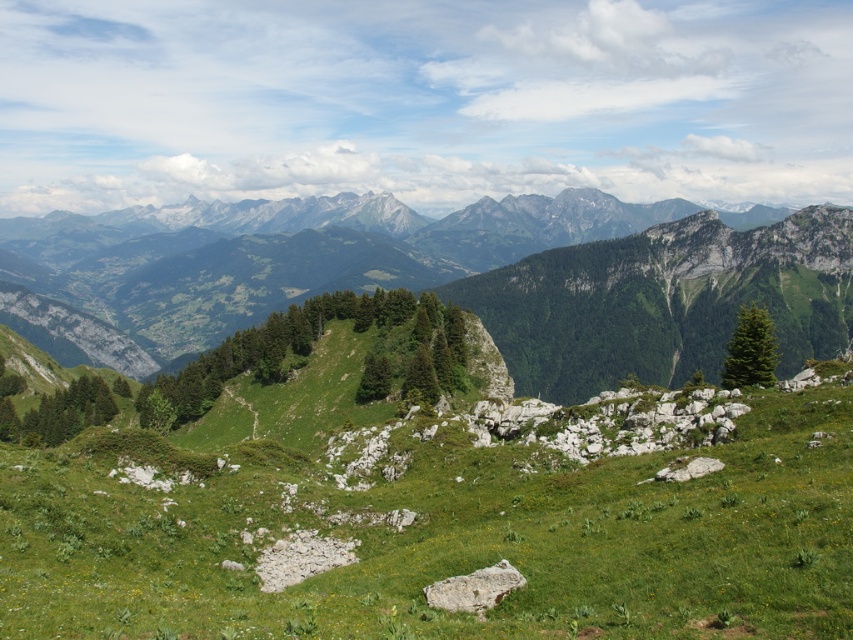
Can you confirm if green grassy hillside at center is shorter than green grassy mountain range at upper center?

Yes.

Is green grassy hillside at center smaller than green grassy mountain range at upper center?

Yes.

The image size is (853, 640). What do you see at coordinates (460, 449) in the screenshot?
I see `green grassy hillside at center` at bounding box center [460, 449].

What are the coordinates of `green grassy hillside at center` in the screenshot? It's located at (460, 449).